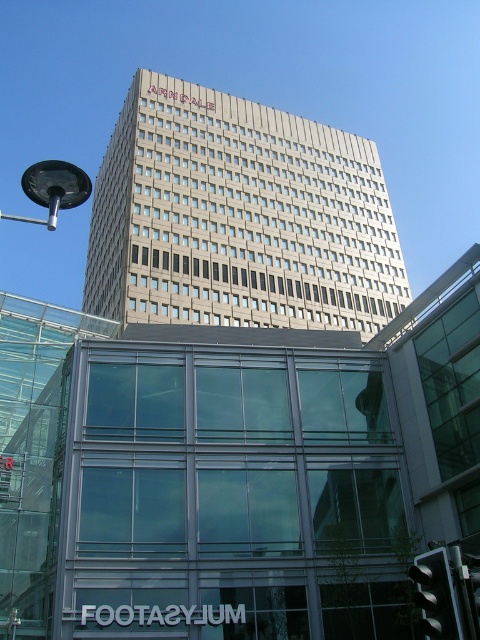
Question: Which object appears closest to the camera in this image?

Choices:
 (A) beige concrete building at upper center
 (B) black metallic streetlight at upper left

Answer: (B)

Question: Observing the image, what is the correct spatial positioning of beige concrete building at upper center in reference to black metallic streetlight at upper left?

Choices:
 (A) below
 (B) above

Answer: (A)

Question: Does beige concrete building at upper center come in front of black metallic streetlight at upper left?

Choices:
 (A) yes
 (B) no

Answer: (B)

Question: Can you confirm if beige concrete building at upper center is wider than black metallic streetlight at upper left?

Choices:
 (A) yes
 (B) no

Answer: (B)